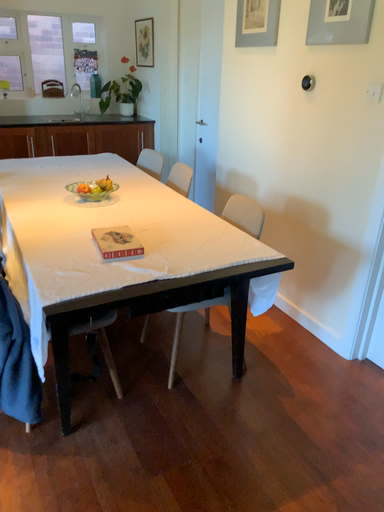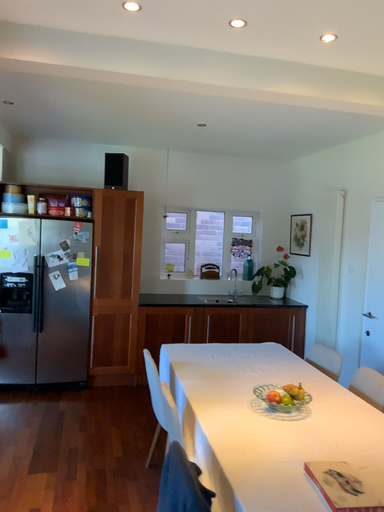
Question: How did the camera likely rotate when shooting the video?

Choices:
 (A) rotated left
 (B) rotated right

Answer: (A)